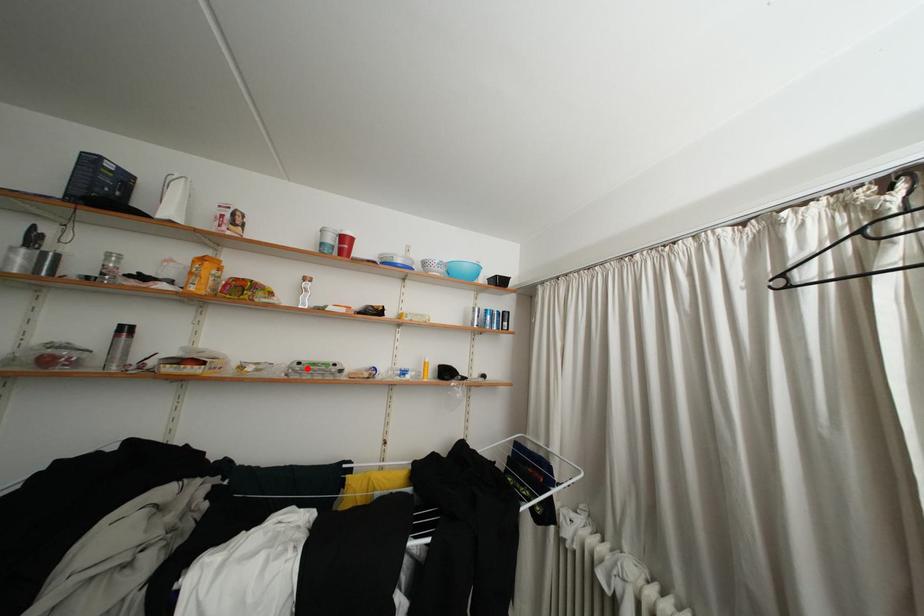
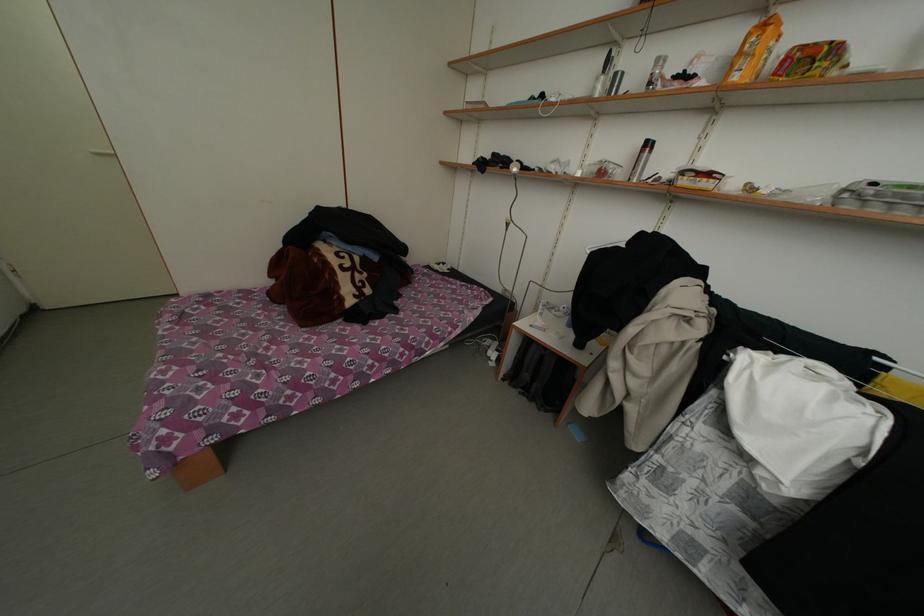
In the second image, find the point that corresponds to the highlighted location in the first image.

(881, 188)